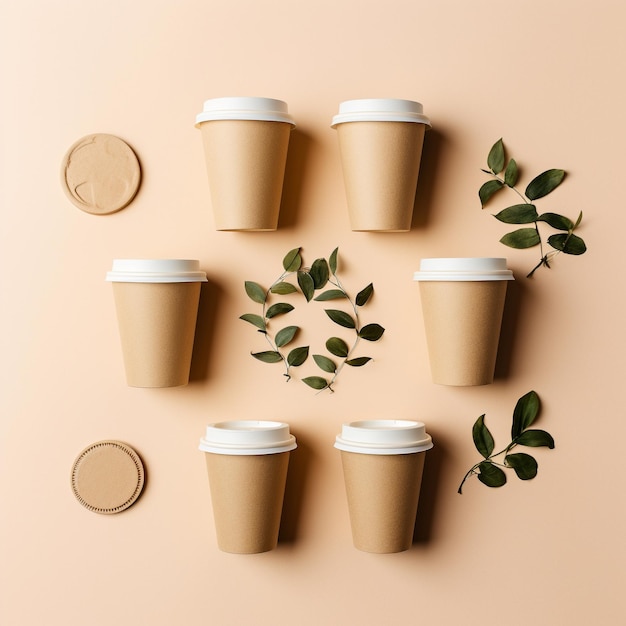
Identify the location of cups. (254, 509), (374, 475), (438, 298), (270, 173), (158, 314), (386, 177).